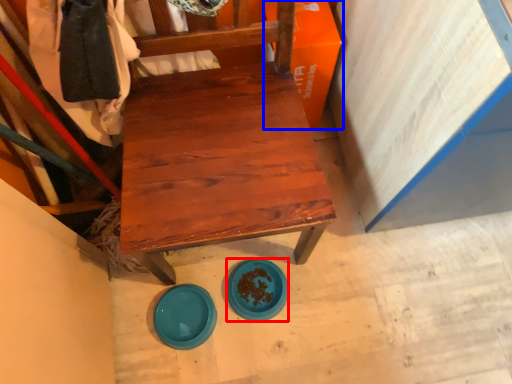
Question: Which object appears closest to the camera in this image, plate (highlighted by a red box) or cardboard box (highlighted by a blue box)?

Choices:
 (A) plate
 (B) cardboard box

Answer: (B)